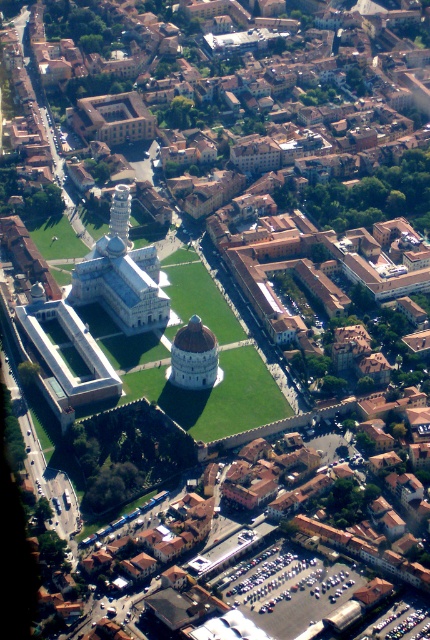
You are standing at the point with coordinates point (x=120, y=205) and want to take a photo of the point (x=183, y=340). Since you have a camera with a limited zoom, will you be able to capture both points in the same frame without moving?

The point (x=183, y=340) is closer to the camera than point (x=120, y=205). Therefore, both points will be within the same frame as the closer point is in front of the farther one, allowing them to be captured together.

You are standing in the Piazza dei Miracoli and want to take a photo of both the white marble dome at center and the smooth white tower at center. Which direction should you face to ensure both are visible in your frame?

You should face towards the left side of the square because the white marble dome at center is to the right of the smooth white tower at center, so positioning yourself to the left will allow both to be captured in the photo.